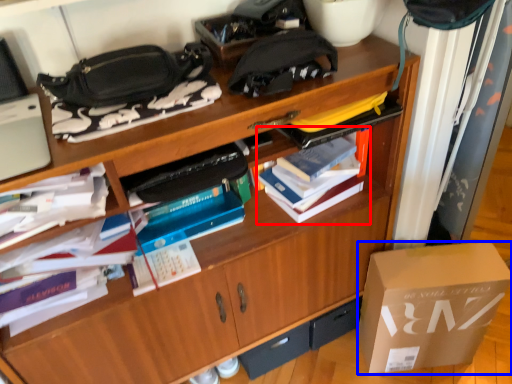
Question: Which point is further to the camera, book (highlighted by a red box) or box (highlighted by a blue box)?

Choices:
 (A) book
 (B) box

Answer: (B)